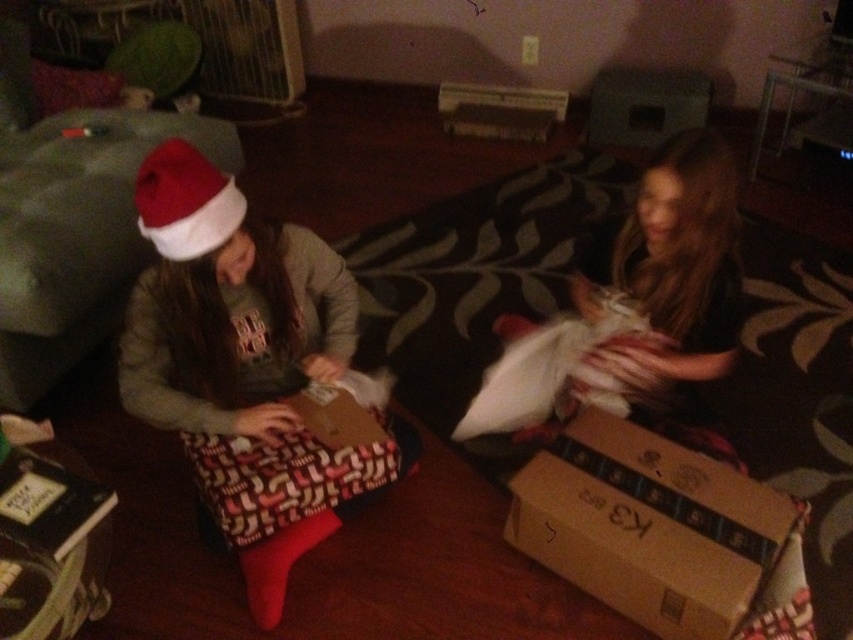
Between matte brown gift at left and brown cardboard box at lower right, which one has more height?

matte brown gift at left is taller.

Can you confirm if matte brown gift at left is smaller than brown cardboard box at lower right?

Actually, matte brown gift at left might be larger than brown cardboard box at lower right.

Is point (387, 477) less distant than point (546, 483)?

No.

Where is `matte brown gift at left`? This screenshot has width=853, height=640. matte brown gift at left is located at coordinates (245, 364).

Where is `matte brown gift at left`? Image resolution: width=853 pixels, height=640 pixels. matte brown gift at left is located at coordinates (245, 364).

Measure the distance between matte brown gift at left and camera.

matte brown gift at left is 1.27 meters away from camera.

Find the location of `matte brown gift at left`. matte brown gift at left is located at coordinates (245, 364).

Which is behind, point (715, 166) or point (183, 230)?

Point (715, 166)

From the picture: Is white fluffy pillow at right wider than red matte santa hat at upper left?

Yes.

Is point (730, 305) closer to viewer compared to point (177, 173)?

No, (730, 305) is behind (177, 173).

Where is `white fluffy pillow at right`? white fluffy pillow at right is located at coordinates (642, 305).